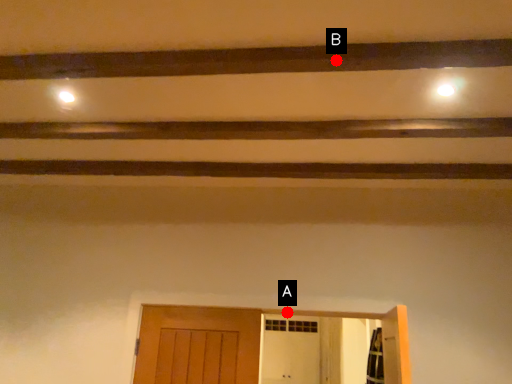
Question: Two points are circled on the image, labeled by A and B beside each circle. Among these points, which one is farthest from the camera?

Choices:
 (A) A is further
 (B) B is further

Answer: (A)